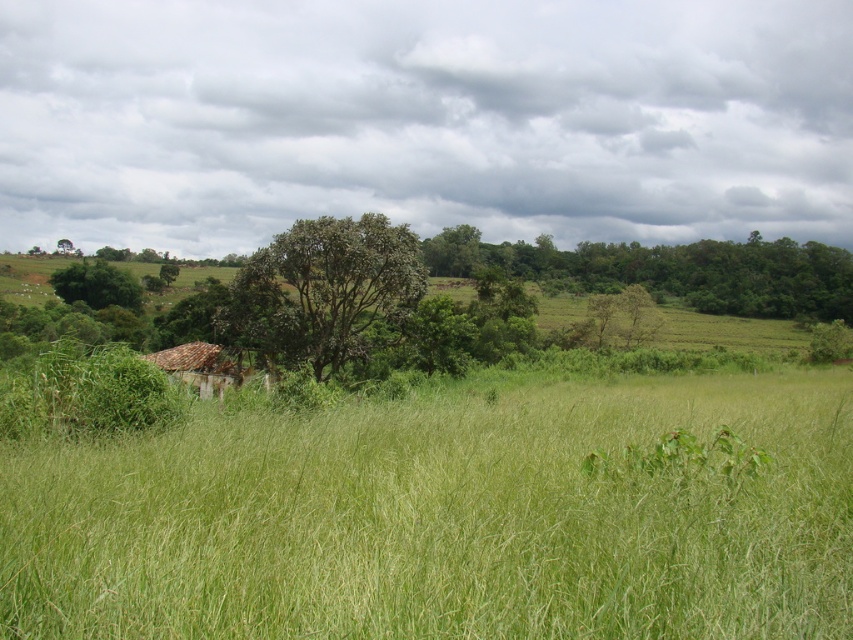
You are standing at the center of the image and want to walk towards the green grassy field at center. In which direction should you move relative to your current position?

The green grassy field at center is already at your current position, so you don not need to move in any direction.

You are a landscape architect planning to install a new pathway in the green grassy field at center and the brown tile roof at center. Which area has a wider space to accommodate a wider path?

The green grassy field at center has a larger width than the brown tile roof at center, so it can accommodate a wider path.